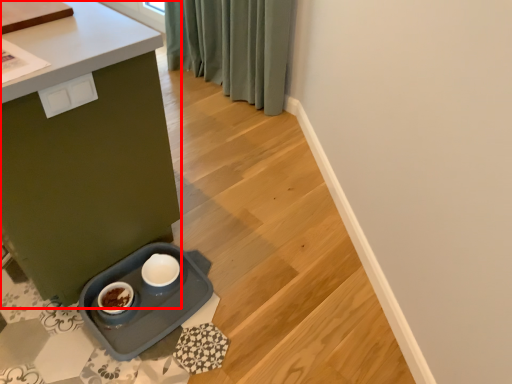
Question: From the image's perspective, considering the relative positions of table (annotated by the red box) and drawer in the image provided, where is table (annotated by the red box) located with respect to the staircase?

Choices:
 (A) below
 (B) above

Answer: (B)